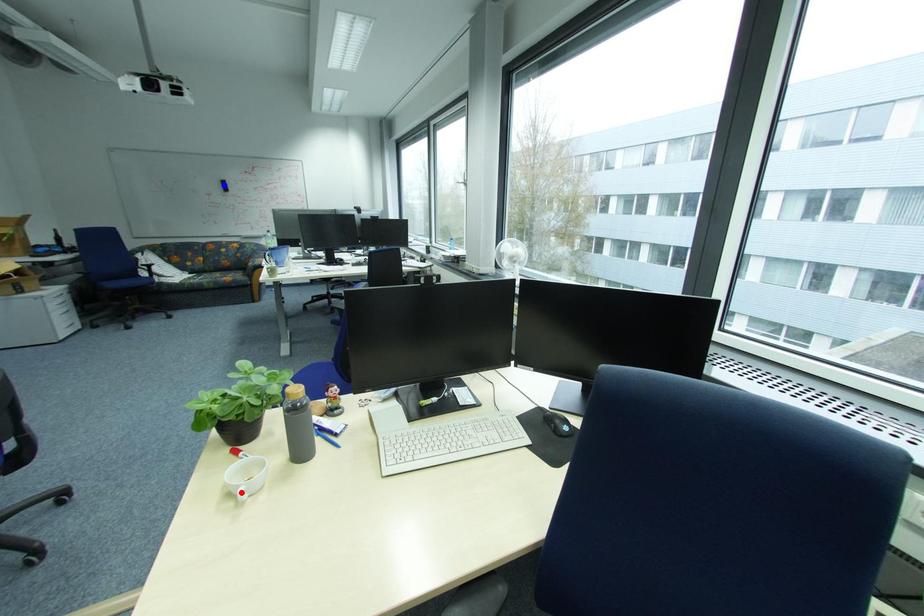
Question: Two points are marked on the image. Which point is closer to the camera?

Choices:
 (A) Blue point is closer.
 (B) Red point is closer.

Answer: (B)